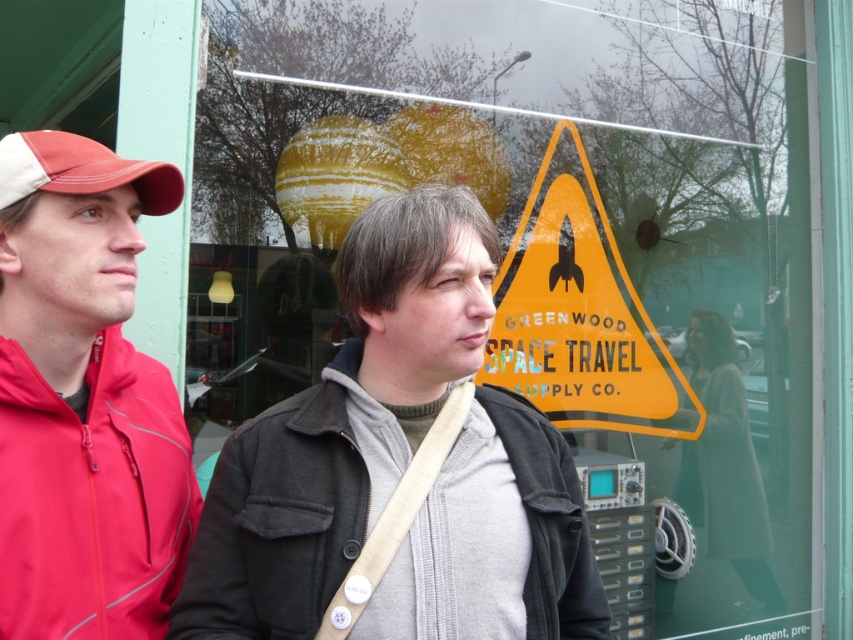
You are a photographer trying to capture the two people in front of the storefront. The white cotton dress at center and the matte red baseball cap at left must both be in the frame. Based on their positions, which object should you focus on first to ensure both are in the shot?

The white cotton dress at center is to the right of the matte red baseball cap at left, so you should focus on the matte red baseball cap at left first to ensure both are in the frame.